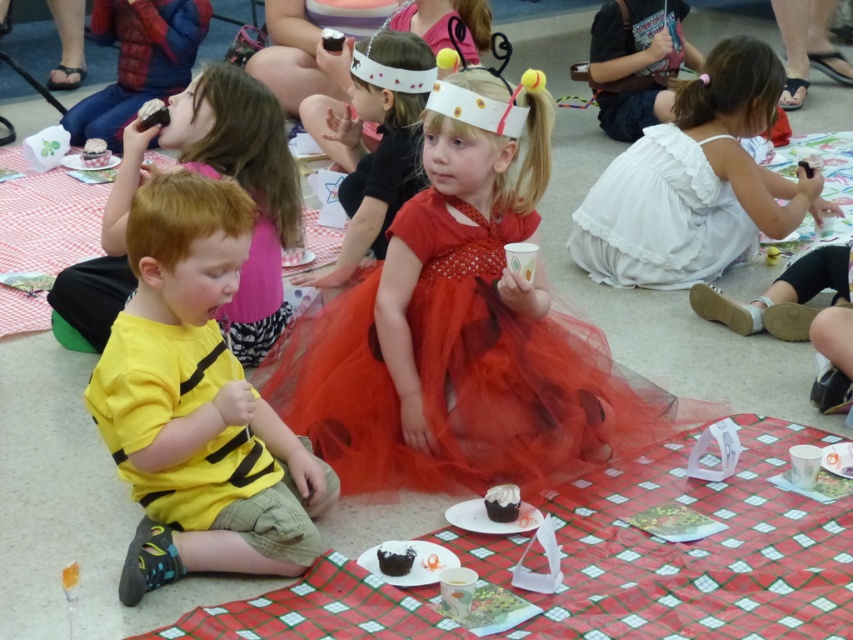
Question: Which of the following is the farthest from the observer?

Choices:
 (A) (433, 538)
 (B) (222, 468)

Answer: (A)

Question: Based on their relative distances, which object is nearer to the yellow matte shirt at left?

Choices:
 (A) white cotton dress at right
 (B) chocolate cake at center
 (C) yellow cotton shirt at left

Answer: (C)

Question: Which object appears closest to the camera in this image?

Choices:
 (A) yellow matte shirt at left
 (B) white cotton dress at center
 (C) matte red tutu at center
 (D) red checkered tablecloth at lower center

Answer: (D)

Question: Does white cotton dress at center appear on the right side of matte red tutu at center?

Choices:
 (A) yes
 (B) no

Answer: (A)

Question: Can you confirm if yellow cotton shirt at left is wider than white cotton dress at center?

Choices:
 (A) yes
 (B) no

Answer: (B)

Question: Does white cotton dress at right appear on the left side of chocolate cake at center?

Choices:
 (A) yes
 (B) no

Answer: (B)